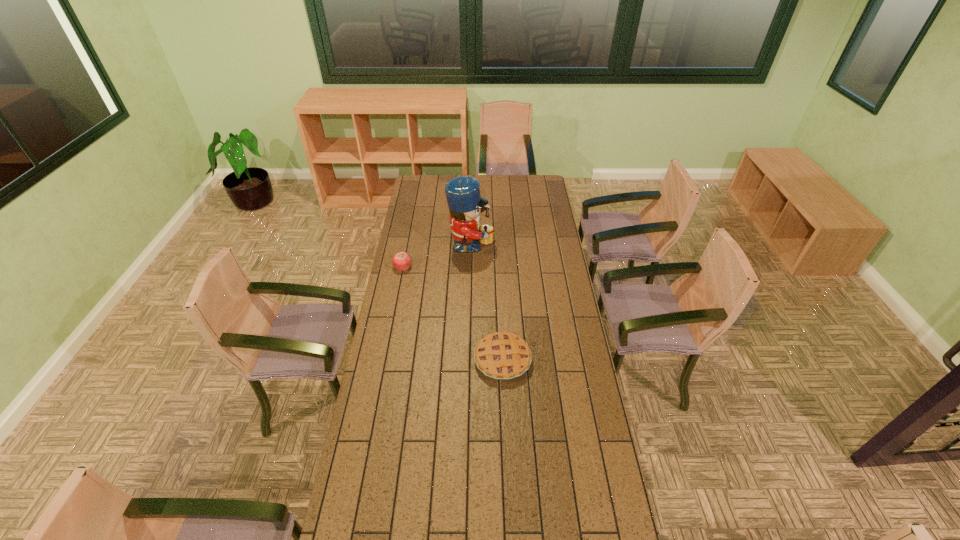
The height and width of the screenshot is (540, 960). In the image, there is a desktop. What are the coordinates of `vacant space at the left edge` in the screenshot? It's located at (394, 409).

What are the coordinates of `blank space at the right edge` in the screenshot? It's located at 565,470.

Find the location of `vacant space at the far left corner of the desktop`. vacant space at the far left corner of the desktop is located at coordinates (426, 186).

Identify the location of vacant region between the shortest object and the second tallest object. (453, 313).

Locate an element on the screen. The width and height of the screenshot is (960, 540). free space between the leftmost object and the nutcracker is located at coordinates (437, 258).

Where is `the closest object relative to the apple`? the closest object relative to the apple is located at coordinates pyautogui.click(x=465, y=204).

Locate which object ranks in proximity to the tallest object. Please provide its 2D coordinates. Your answer should be formatted as a tuple, i.e. [(x, y)], where the tuple contains the x and y coordinates of a point satisfying the conditions above.

[(402, 260)]

Find the location of a particular element. This screenshot has height=540, width=960. vacant area in the image that satisfies the following two spatial constraints: 1. on the front-facing side of the pie; 2. on the left side of the tallest object is located at coordinates (468, 360).